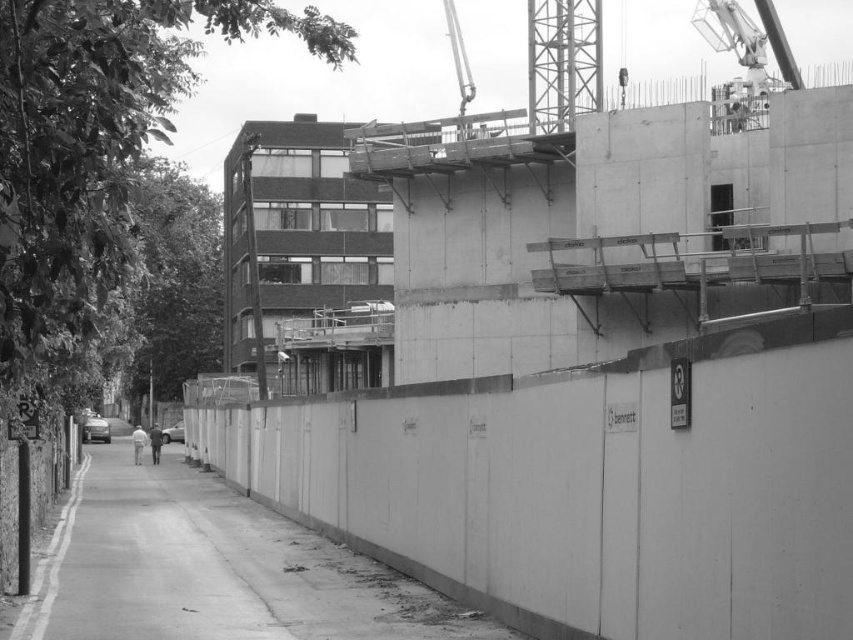
Question: Does shiny silver car at lower left appear under metallic silver car at center?

Choices:
 (A) no
 (B) yes

Answer: (A)

Question: Can you confirm if shiny silver car at lower left is bigger than metallic silver car at center?

Choices:
 (A) no
 (B) yes

Answer: (B)

Question: Which point is farther to the camera?

Choices:
 (A) (94, 417)
 (B) (178, 422)

Answer: (A)

Question: Which object is positioned closest to the smooth concrete wall at center?

Choices:
 (A) metallic silver car at center
 (B) shiny silver car at lower left

Answer: (B)

Question: Which object is farther from the camera taking this photo?

Choices:
 (A) metallic silver car at center
 (B) smooth concrete wall at center

Answer: (A)

Question: Is shiny silver car at lower left closer to camera compared to metallic silver car at center?

Choices:
 (A) no
 (B) yes

Answer: (B)